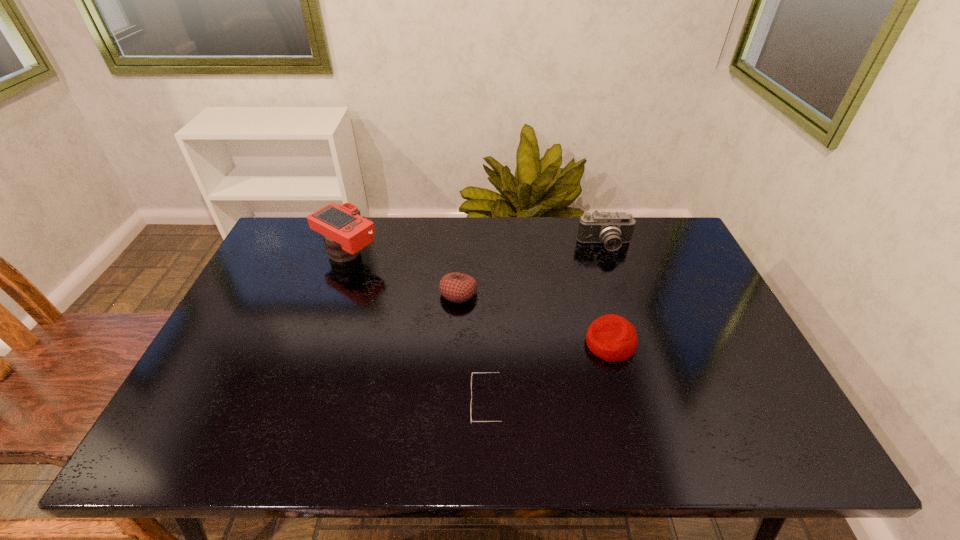
Locate an element on the screen. vacant space that satisfies the following two spatial constraints: 1. on the front-facing side of the right camera; 2. on the seat area of the right beanbag is located at coordinates (638, 343).